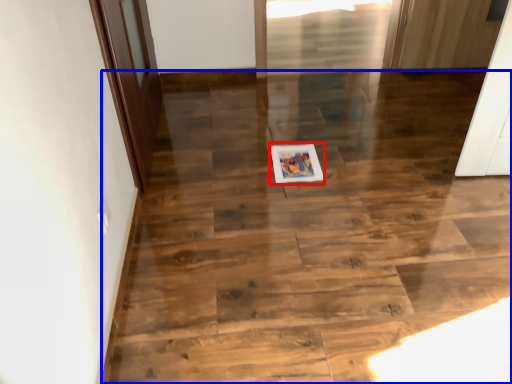
Question: Which object is further to the camera taking this photo, postcard (highlighted by a red box) or stairwell (highlighted by a blue box)?

Choices:
 (A) postcard
 (B) stairwell

Answer: (A)